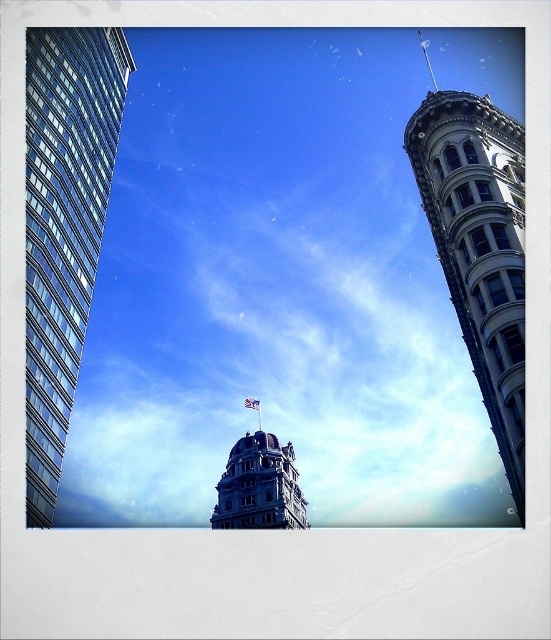
You are standing in the middle of the city square, facing the glassy reflective skyscraper at left and blue stone tower at center. Which building is positioned to the left?

The glassy reflective skyscraper at left is positioned to the left of the blue stone tower at center.

You are a drone operator tasked with flying a drone from the glassy reflective skyscraper at left to the white fabric flag at center. What is the approximate distance you need to cover?

The glassy reflective skyscraper at left and white fabric flag at center are 53.38 meters apart, so the drone needs to cover approximately 53.38 meters to reach the flag.

Looking at this image, you are standing in the city square and notice the glassy reflective skyscraper at left and the white fabric flag at center. Which object appears wider from your viewpoint?

The glassy reflective skyscraper at left might be wider than the white fabric flag at center according to the description.